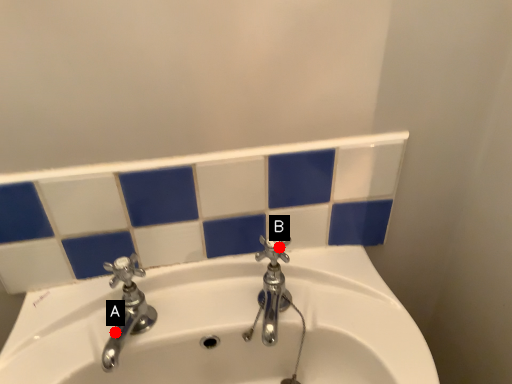
Question: Two points are circled on the image, labeled by A and B beside each circle. Among these points, which one is nearest to the camera?

Choices:
 (A) A is closer
 (B) B is closer

Answer: (A)